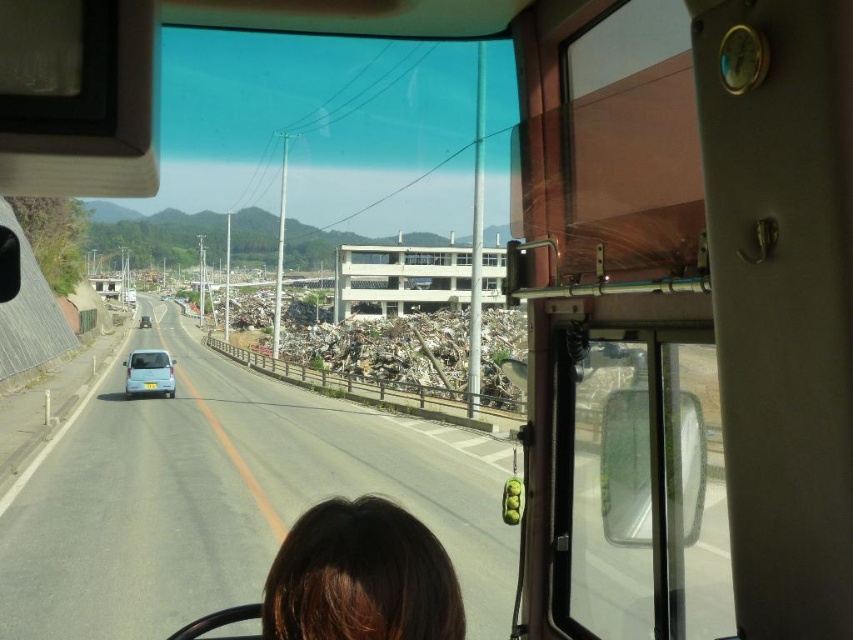
You are a passenger in the vehicle and want to know which of the two points, point (114, 636) or point (329, 500), is closer to the front windshield. Based on the scene, can you determine this?

Point (329, 500) is closer to the front windshield because it is closer to the camera than point (114, 636).

You are a passenger in the vehicle and notice your reflection in the side mirror. You see the asphalt road at center and the brown hair at lower center in your reflection. Which object is closer to you?

The brown hair at lower center is behind asphalt road at center, so the asphalt road at center is closer to you.